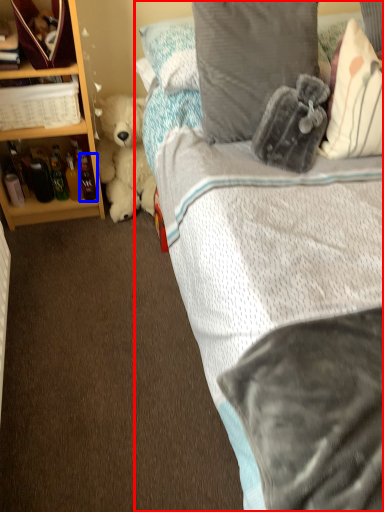
Question: Among these objects, which one is farthest to the camera, bed (highlighted by a red box) or bottle (highlighted by a blue box)?

Choices:
 (A) bed
 (B) bottle

Answer: (B)